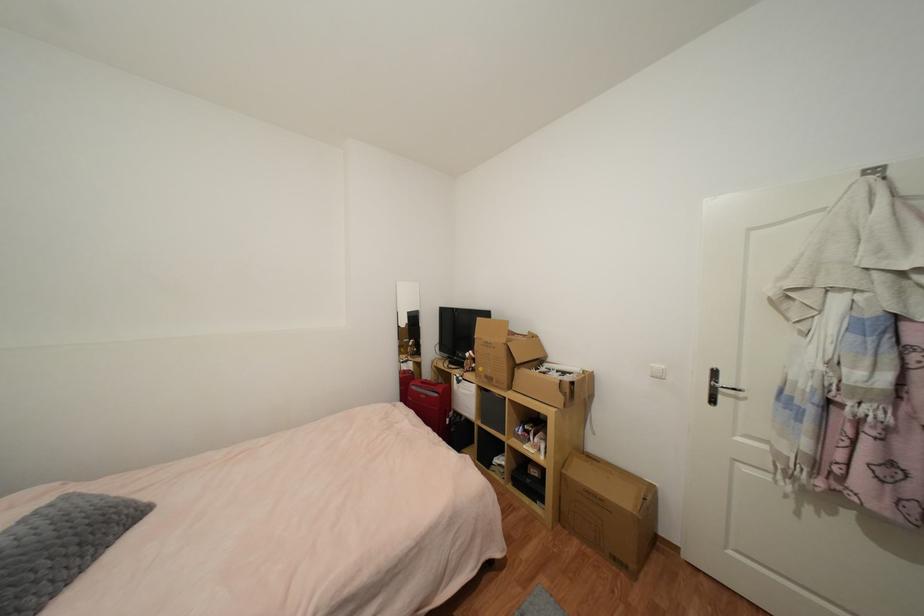
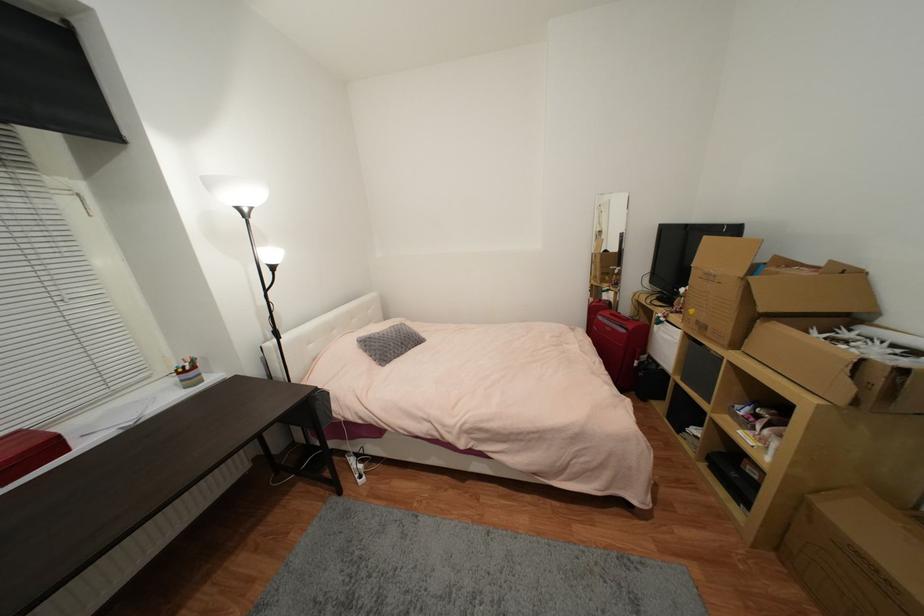
Where in the second image is the point corresponding to point 458,413 from the first image?

(653, 359)